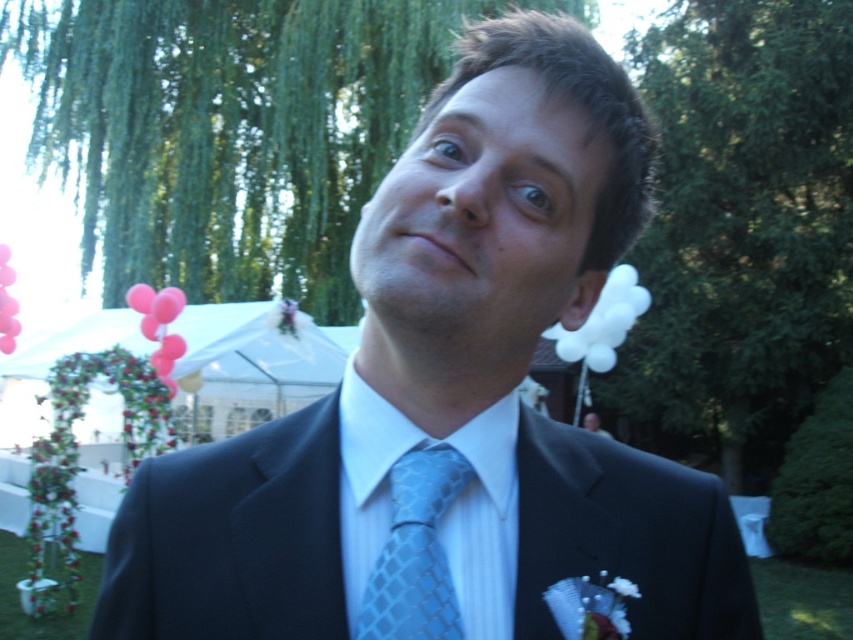
Which is behind, point (280, 592) or point (428, 582)?

Positioned behind is point (280, 592).

Between black satin suit at center and light blue textured tie at center, which one has less height?

light blue textured tie at center

Is point (334, 508) closer to viewer compared to point (439, 577)?

No, (334, 508) is further to viewer.

You are a GUI agent. You are given a task and a screenshot of the screen. Output one action in this format:
    pyautogui.click(x=<x>, y=<y>)
    Task: Click on the black satin suit at center
    
    Given the screenshot: What is the action you would take?
    pyautogui.click(x=229, y=541)